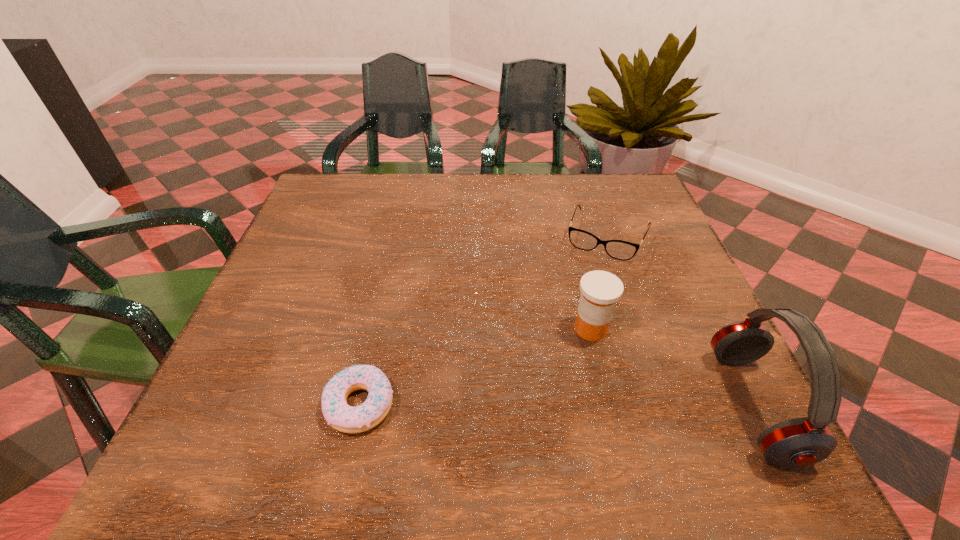
Identify the location of doughnut. The image size is (960, 540). (338, 414).

Locate an element on the screen. the tallest object is located at coordinates (799, 442).

Find the location of `the rightmost object`. the rightmost object is located at coordinates (799, 442).

Identify the location of spectacles. (618, 249).

You are a GUI agent. You are given a task and a screenshot of the screen. Output one action in this format:
    pyautogui.click(x=<x>, y=<y>)
    Task: Click on the second tallest object
    The width and height of the screenshot is (960, 540).
    Given the screenshot: What is the action you would take?
    pyautogui.click(x=600, y=290)

Locate an element on the screen. The width and height of the screenshot is (960, 540). the third nearest object is located at coordinates (600, 290).

You are a GUI agent. You are given a task and a screenshot of the screen. Output one action in this format:
    pyautogui.click(x=<x>, y=<y>)
    Task: Click on the free location located 0.360m on the right of the doughnut
    The height and width of the screenshot is (540, 960).
    Given the screenshot: What is the action you would take?
    pyautogui.click(x=607, y=404)

The height and width of the screenshot is (540, 960). I want to click on vacant area situated on the ear cups of the earphone, so click(x=565, y=405).

Identify the location of vacant space located on the ear cups of the earphone. (612, 405).

Where is `vacant space positioned 0.290m on the ear cups of the earphone`? vacant space positioned 0.290m on the ear cups of the earphone is located at coordinates (554, 405).